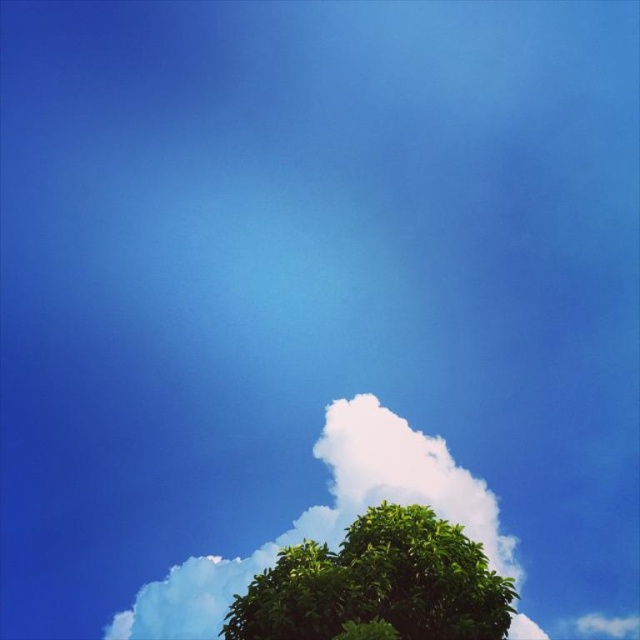
Consider the image. You are a bird flying in the sky and want to land on the closest object. Which object should you choose between the green leafy tree at lower center and the white fluffy cloud at lower center?

The green leafy tree at lower center is larger in size than the white fluffy cloud at lower center, so the bird should choose the green leafy tree at lower center to land since it provides a larger and more stable surface.

You are a bird flying in the sky and want to land on the nearest tree. You see the green leafy tree at lower center. Where should you head to land?

The green leafy tree at lower center is located at point (378, 584), so you should head towards that coordinate to land.